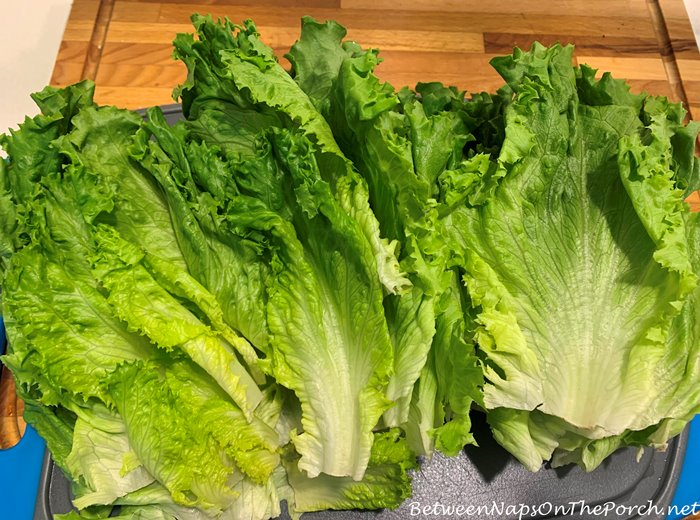
This screenshot has height=520, width=700. Find the location of `white surface`. white surface is located at coordinates (42, 48).